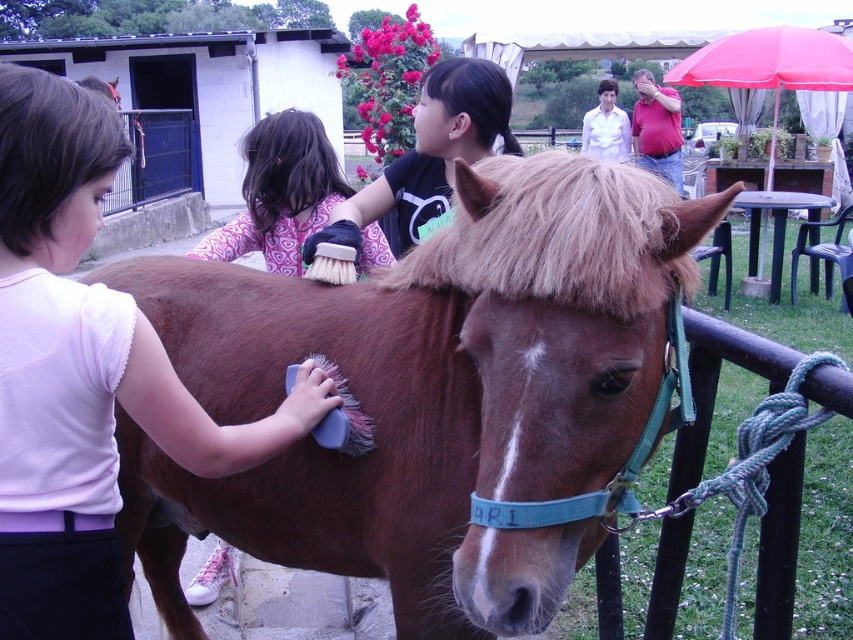
Question: Which point appears closest to the camera in this image?

Choices:
 (A) (256, 544)
 (B) (335, 243)
 (C) (285, 260)
 (D) (494, 156)

Answer: (D)

Question: Does matte white shirt at left have a larger size compared to patterned fabric brush at upper center?

Choices:
 (A) yes
 (B) no

Answer: (B)

Question: Which point is closer to the camera?

Choices:
 (A) patterned fabric brush at upper center
 (B) black fabric shirt at upper center
 (C) matte white shirt at left
 (D) fuzzy brown mane at center

Answer: (D)

Question: Does matte white shirt at left have a lesser width compared to patterned fabric brush at upper center?

Choices:
 (A) no
 (B) yes

Answer: (B)

Question: Is brown matte horse at center wider than black fabric shirt at upper center?

Choices:
 (A) no
 (B) yes

Answer: (B)

Question: Estimate the real-world distances between objects in this image. Which object is closer to the matte white shirt at left?

Choices:
 (A) fuzzy brown mane at center
 (B) black fabric shirt at upper center
 (C) brown matte horse at center
 (D) patterned fabric brush at upper center

Answer: (C)